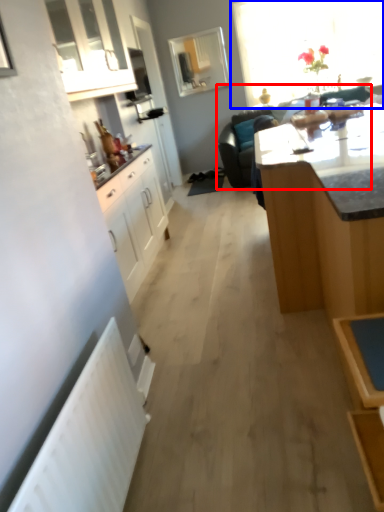
Question: Among these objects, which one is farthest to the camera, studio couch (highlighted by a red box) or window (highlighted by a blue box)?

Choices:
 (A) studio couch
 (B) window

Answer: (B)